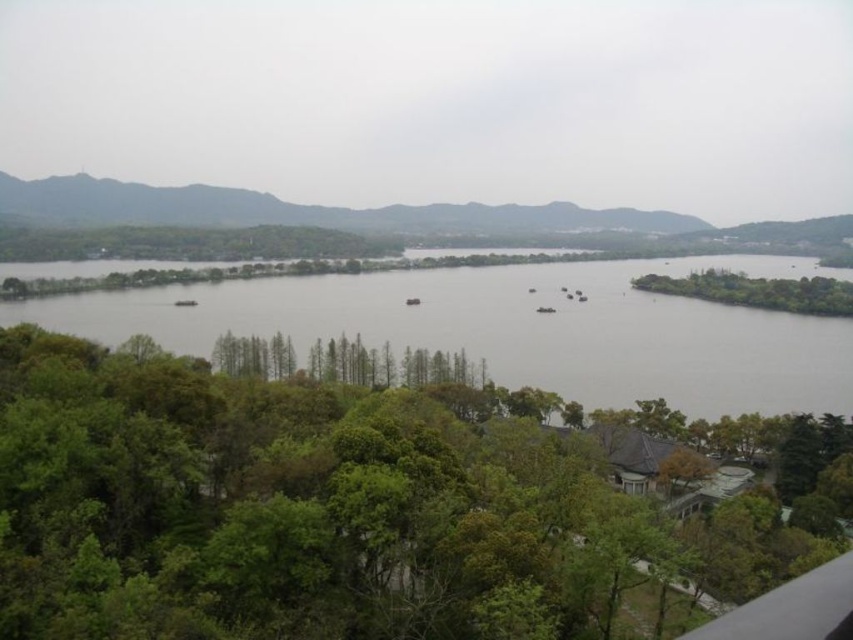
Question: Which point is farther from the camera taking this photo?

Choices:
 (A) 772,300
 (B) 178,221
 (C) 498,301
 (D) 688,564

Answer: (B)

Question: Does green leafy tree at center appear on the left side of green matte mountains at upper left?

Choices:
 (A) no
 (B) yes

Answer: (B)

Question: Where is green leafy tree at center located in relation to gray water at center in the image?

Choices:
 (A) above
 (B) below

Answer: (B)

Question: Is green leafy tree at center thinner than green leafy tree at right?

Choices:
 (A) no
 (B) yes

Answer: (B)

Question: Which of the following is the closest to the observer?

Choices:
 (A) (100, 360)
 (B) (90, 177)
 (C) (782, 298)

Answer: (A)

Question: Which of these objects is positioned farthest from the green leafy tree at right?

Choices:
 (A) green matte mountains at upper left
 (B) green leafy tree at center

Answer: (B)